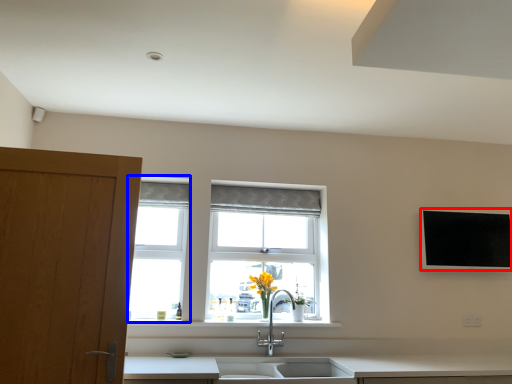
Question: Among these objects, which one is farthest to the camera, flat (highlighted by a red box) or window frame (highlighted by a blue box)?

Choices:
 (A) flat
 (B) window frame

Answer: (A)